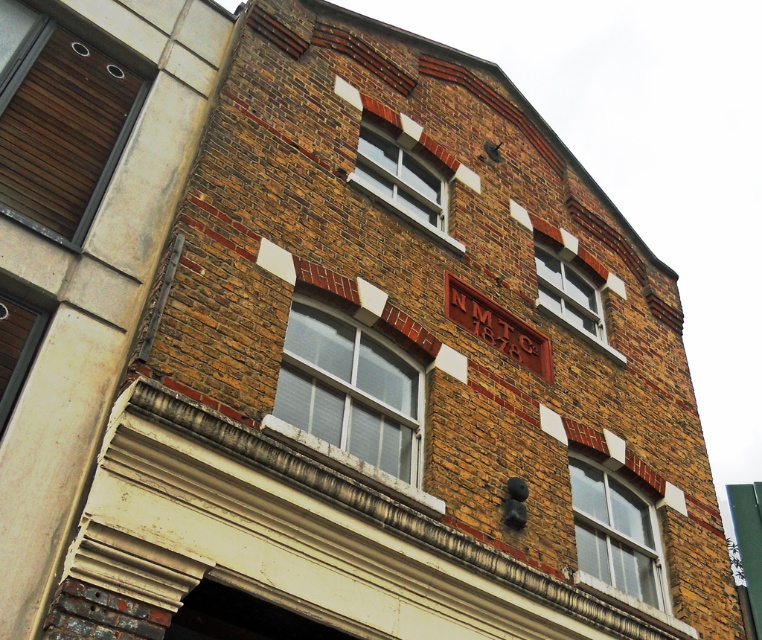
You are standing in front of the brick building and want to know how far the point at coordinates (376, 387) is from you. Can you determine the distance?

The point at coordinates (376, 387) is 11.55 meters away from you.